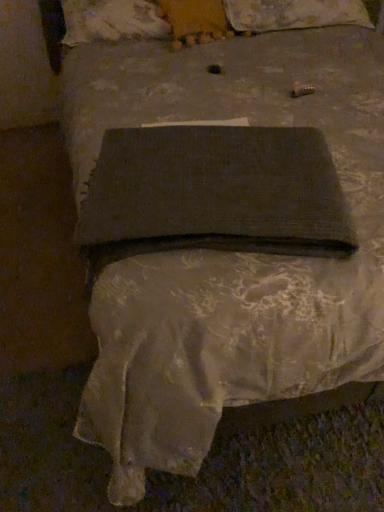
How much space does fluffy white pillow at upper center, the 2th pillow in the left-to-right sequence, occupy vertically?

It is 7.90 inches.

Locate an element on the screen. fluffy beige pillow at upper center, the first pillow from the left is located at coordinates (112, 21).

Image resolution: width=384 pixels, height=512 pixels. What are the coordinates of `dark fabric book at center` in the screenshot? It's located at click(214, 186).

Image resolution: width=384 pixels, height=512 pixels. I want to click on fluffy white pillow at upper center, the 2th pillow in the left-to-right sequence, so click(x=294, y=14).

Which object is thinner, dark fabric book at center or fluffy beige pillow at upper center, the first pillow from the left?

With smaller width is fluffy beige pillow at upper center, the first pillow from the left.

Locate an element on the screen. Image resolution: width=384 pixels, height=512 pixels. pad that appears below the fluffy beige pillow at upper center, which ranks as the 2th pillow in right-to-left order (from the image's perspective) is located at coordinates (214, 186).

Is dark fabric book at center next to fluffy beige pillow at upper center, the first pillow from the left, and touching it?

No, dark fabric book at center is not making contact with fluffy beige pillow at upper center, the first pillow from the left.

Is point (257, 173) closer or farther from the camera than point (133, 19)?

Point (257, 173).

Is dark fabric book at center oriented away from fluffy white pillow at upper center, the 2th pillow in the left-to-right sequence?

Yes.

Which object is further away from the camera, dark fabric book at center or fluffy white pillow at upper center, the first pillow viewed from the right?

Positioned behind is fluffy white pillow at upper center, the first pillow viewed from the right.

From a real-world perspective, is dark fabric book at center above or below fluffy white pillow at upper center, the first pillow viewed from the right?

In terms of real-world spatial position, dark fabric book at center is above fluffy white pillow at upper center, the first pillow viewed from the right.

In the scene shown: Which of these two, fluffy beige pillow at upper center, the first pillow from the left, or dark fabric book at center, is wider?

dark fabric book at center is wider.

Who is more distant, fluffy beige pillow at upper center, the first pillow from the left, or dark fabric book at center?

fluffy beige pillow at upper center, the first pillow from the left, is behind.

Considering the relative positions of fluffy beige pillow at upper center, the first pillow from the left, and dark fabric book at center in the image provided, is fluffy beige pillow at upper center, the first pillow from the left, to the left of dark fabric book at center from the viewer's perspective?

Correct, you'll find fluffy beige pillow at upper center, the first pillow from the left, to the left of dark fabric book at center.

In the scene shown: Which object is thinner, fluffy white pillow at upper center, the 2th pillow in the left-to-right sequence, or dark fabric book at center?

Thinner between the two is dark fabric book at center.

How different are the orientations of fluffy white pillow at upper center, the first pillow viewed from the right, and dark fabric book at center in degrees?

The angle between the facing direction of fluffy white pillow at upper center, the first pillow viewed from the right, and the facing direction of dark fabric book at center is 16.7 degrees.

Find the location of a particular element. pillow on the right of dark fabric book at center is located at coordinates (294, 14).

From their relative heights in the image, would you say fluffy beige pillow at upper center, the first pillow from the left, is taller or shorter than fluffy white pillow at upper center, the first pillow viewed from the right?

fluffy beige pillow at upper center, the first pillow from the left, is taller than fluffy white pillow at upper center, the first pillow viewed from the right.

Identify the location of pillow below the fluffy beige pillow at upper center, the first pillow from the left (from a real-world perspective). This screenshot has width=384, height=512. (294, 14).

Considering the sizes of objects fluffy beige pillow at upper center, which ranks as the 2th pillow in right-to-left order, and fluffy white pillow at upper center, the first pillow viewed from the right, in the image provided, who is thinner, fluffy beige pillow at upper center, which ranks as the 2th pillow in right-to-left order, or fluffy white pillow at upper center, the first pillow viewed from the right,?

Thinner between the two is fluffy beige pillow at upper center, which ranks as the 2th pillow in right-to-left order.

From the image's perspective, is fluffy beige pillow at upper center, the first pillow from the left, positioned above or below fluffy white pillow at upper center, the first pillow viewed from the right?

Based on their image positions, fluffy beige pillow at upper center, the first pillow from the left, is located beneath fluffy white pillow at upper center, the first pillow viewed from the right.

Does point (253, 17) lie in front of point (135, 9)?

That is False.

From the image's perspective, is fluffy white pillow at upper center, the 2th pillow in the left-to-right sequence, located above or below fluffy beige pillow at upper center, which ranks as the 2th pillow in right-to-left order?

fluffy white pillow at upper center, the 2th pillow in the left-to-right sequence, is above fluffy beige pillow at upper center, which ranks as the 2th pillow in right-to-left order.

Measure the distance from fluffy white pillow at upper center, the first pillow viewed from the right, to fluffy beige pillow at upper center, the first pillow from the left.

22.85 inches.

What's the angular difference between fluffy white pillow at upper center, the 2th pillow in the left-to-right sequence, and fluffy beige pillow at upper center, the first pillow from the left,'s facing directions?

0.601 degrees separate the facing orientations of fluffy white pillow at upper center, the 2th pillow in the left-to-right sequence, and fluffy beige pillow at upper center, the first pillow from the left.

Where is `pillow that is above the dark fabric book at center (from a real-world perspective)`? pillow that is above the dark fabric book at center (from a real-world perspective) is located at coordinates (112, 21).

This screenshot has width=384, height=512. Identify the location of pad in front of the fluffy white pillow at upper center, the first pillow viewed from the right. (214, 186).

From the image, which object appears to be farther from fluffy beige pillow at upper center, which ranks as the 2th pillow in right-to-left order, fluffy white pillow at upper center, the first pillow viewed from the right, or dark fabric book at center?

dark fabric book at center is further to fluffy beige pillow at upper center, which ranks as the 2th pillow in right-to-left order.

Estimate the real-world distances between objects in this image. Which object is closer to dark fabric book at center, fluffy beige pillow at upper center, which ranks as the 2th pillow in right-to-left order, or fluffy white pillow at upper center, the first pillow viewed from the right?

fluffy beige pillow at upper center, which ranks as the 2th pillow in right-to-left order, is closer to dark fabric book at center.

Based on their spatial positions, is dark fabric book at center or fluffy beige pillow at upper center, which ranks as the 2th pillow in right-to-left order, closer to fluffy white pillow at upper center, the first pillow viewed from the right?

The object closer to fluffy white pillow at upper center, the first pillow viewed from the right, is fluffy beige pillow at upper center, which ranks as the 2th pillow in right-to-left order.

When comparing their distances from fluffy beige pillow at upper center, which ranks as the 2th pillow in right-to-left order, does dark fabric book at center or fluffy white pillow at upper center, the 2th pillow in the left-to-right sequence, seem closer?

fluffy white pillow at upper center, the 2th pillow in the left-to-right sequence, is closer to fluffy beige pillow at upper center, which ranks as the 2th pillow in right-to-left order.

When comparing their distances from dark fabric book at center, does fluffy white pillow at upper center, the 2th pillow in the left-to-right sequence, or fluffy beige pillow at upper center, which ranks as the 2th pillow in right-to-left order, seem closer?

fluffy beige pillow at upper center, which ranks as the 2th pillow in right-to-left order.

Estimate the real-world distances between objects in this image. Which object is further from fluffy white pillow at upper center, the first pillow viewed from the right, fluffy beige pillow at upper center, which ranks as the 2th pillow in right-to-left order, or dark fabric book at center?

dark fabric book at center is positioned further to the anchor fluffy white pillow at upper center, the first pillow viewed from the right.

Identify the location of pillow positioned between dark fabric book at center and fluffy white pillow at upper center, the 2th pillow in the left-to-right sequence, from near to far. (112, 21).